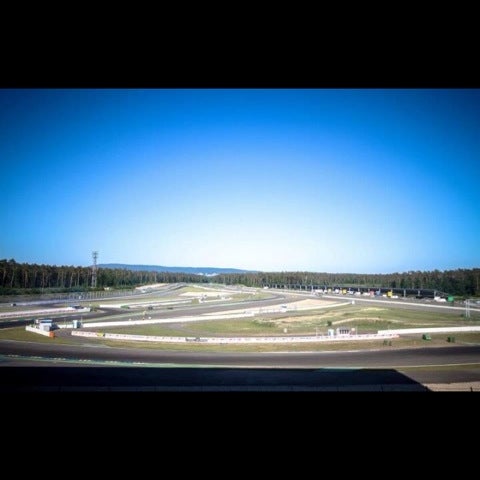
In order to click on shade in this screenshot , I will do `click(379, 373)`, `click(107, 382)`.